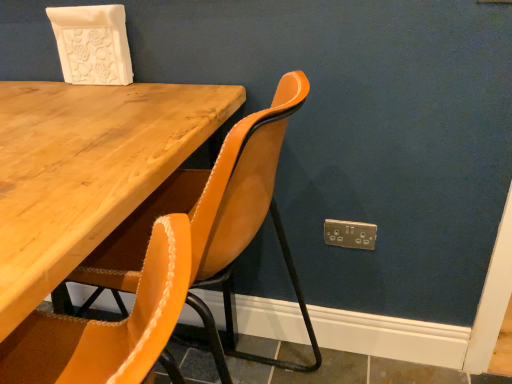
Question: Is suede-like mustard chair at center closer to the viewer compared to gold metallic electric outlet at lower right?

Choices:
 (A) yes
 (B) no

Answer: (A)

Question: Is suede-like mustard chair at center shorter than gold metallic electric outlet at lower right?

Choices:
 (A) no
 (B) yes

Answer: (A)

Question: Considering the relative sizes of suede-like mustard chair at center and gold metallic electric outlet at lower right in the image provided, is suede-like mustard chair at center wider than gold metallic electric outlet at lower right?

Choices:
 (A) yes
 (B) no

Answer: (A)

Question: Is suede-like mustard chair at center positioned beyond the bounds of gold metallic electric outlet at lower right?

Choices:
 (A) no
 (B) yes

Answer: (B)

Question: Is suede-like mustard chair at center positioned behind gold metallic electric outlet at lower right?

Choices:
 (A) no
 (B) yes

Answer: (A)

Question: From a real-world perspective, is suede-like mustard chair at center beneath gold metallic electric outlet at lower right?

Choices:
 (A) no
 (B) yes

Answer: (A)

Question: Can you confirm if gold metallic electric outlet at lower right is taller than suede-like mustard chair at center?

Choices:
 (A) no
 (B) yes

Answer: (A)

Question: From the image's perspective, is gold metallic electric outlet at lower right below suede-like mustard chair at center?

Choices:
 (A) yes
 (B) no

Answer: (B)

Question: Does gold metallic electric outlet at lower right have a greater width compared to suede-like mustard chair at center?

Choices:
 (A) yes
 (B) no

Answer: (B)

Question: Does gold metallic electric outlet at lower right come behind suede-like mustard chair at center?

Choices:
 (A) no
 (B) yes

Answer: (B)

Question: Is suede-like mustard chair at center surrounded by gold metallic electric outlet at lower right?

Choices:
 (A) yes
 (B) no

Answer: (B)

Question: Is gold metallic electric outlet at lower right closer to the viewer compared to suede-like mustard chair at center?

Choices:
 (A) yes
 (B) no

Answer: (B)

Question: From the image's perspective, relative to gold metallic electric outlet at lower right, is suede-like mustard chair at center above or below?

Choices:
 (A) below
 (B) above

Answer: (A)